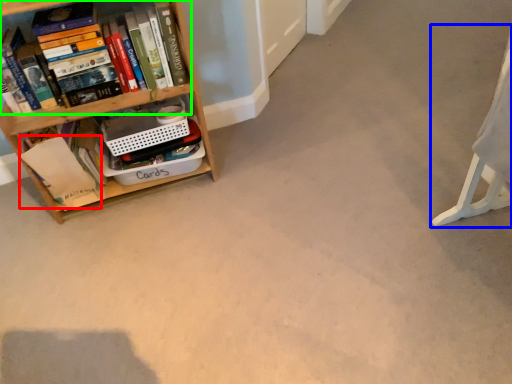
Question: Estimate the real-world distances between objects in this image. Which object is closer to paperback book (highlighted by a red box), swivel chair (highlighted by a blue box) or book (highlighted by a green box)?

Choices:
 (A) swivel chair
 (B) book

Answer: (B)